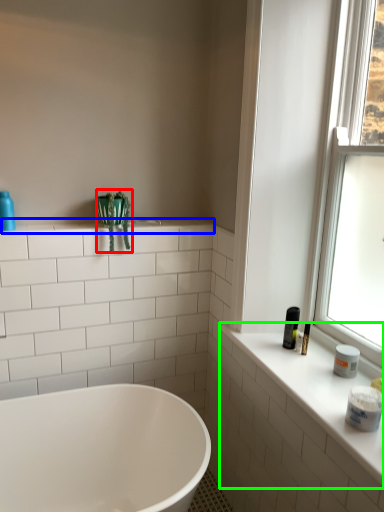
Question: Which object is the closest to the plant (highlighted by a red box)? Choose among these: window sill (highlighted by a blue box) or counter top (highlighted by a green box).

Choices:
 (A) window sill
 (B) counter top

Answer: (A)